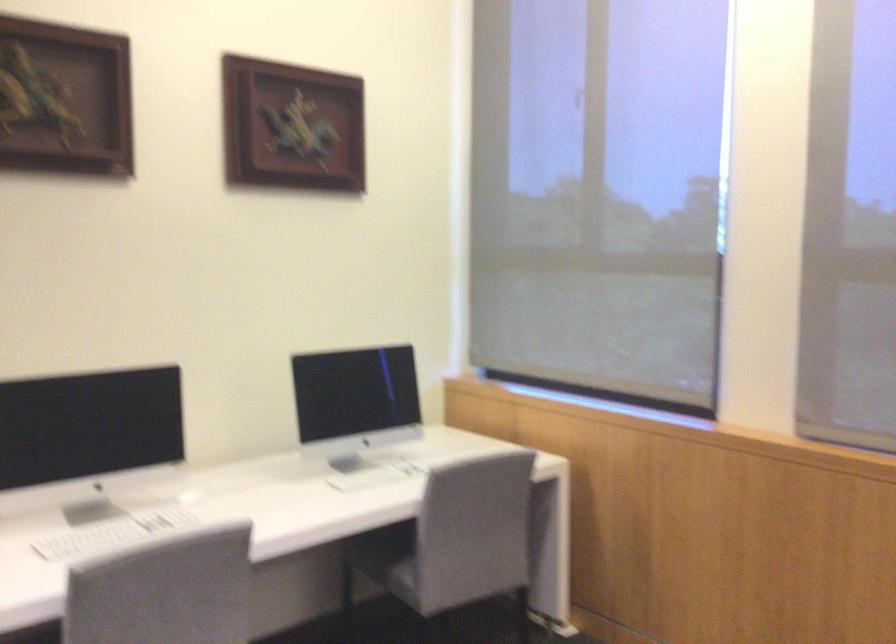
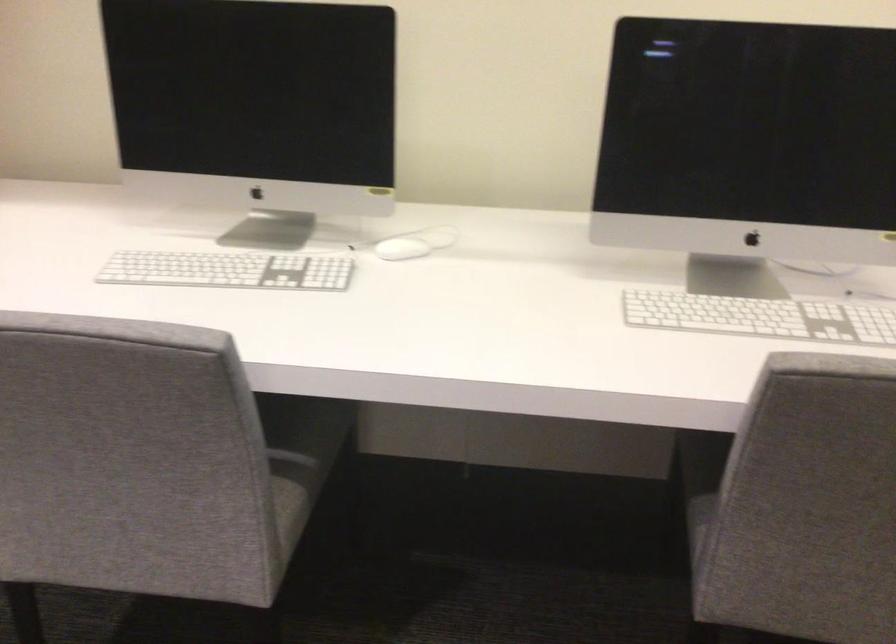
The point at (197, 496) is marked in the first image. Where is the corresponding point in the second image?

(401, 249)